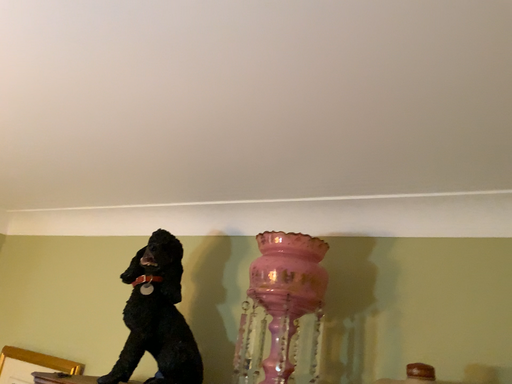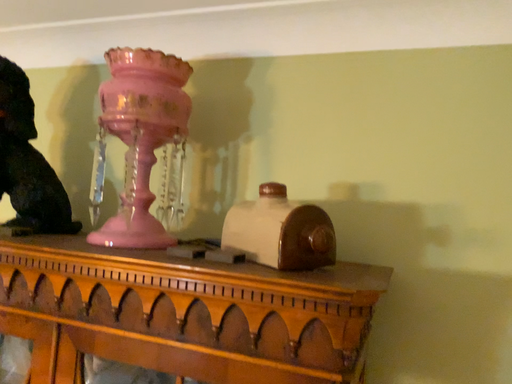
Question: Which way did the camera rotate in the video?

Choices:
 (A) rotated right
 (B) rotated left

Answer: (A)